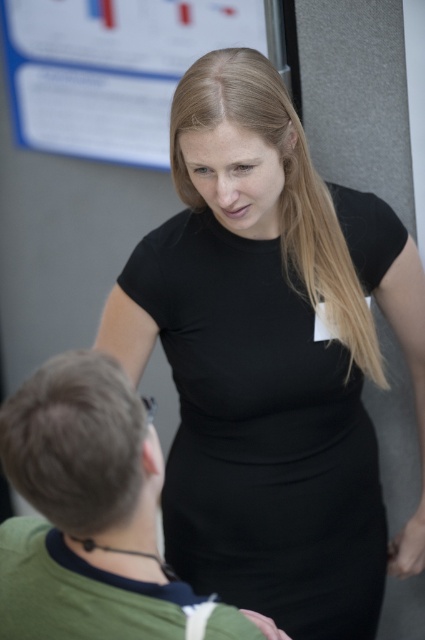
You are an event planner arranging seating for a formal dinner. You need to place a table between the black matte dress at center and the green matte shirt at lower left. Based on their positions, where should the table be placed?

The table should be placed between the black matte dress at center and the green matte shirt at lower left since the black matte dress at center is above the green matte shirt at lower left, so placing the table in between their vertical positions would create a balanced arrangement.

You are organizing a presentation and need to decide which item to place in a narrow display case. The case can only accommodate items that are less than 1 inch thick. You have the green matte shirt at lower left and the blue paper at upper center. Which item would fit better in the case?

The green matte shirt at lower left is thinner than the blue paper at upper center, so it would fit better in the narrow display case.

You are standing in the room and want to place a small plant pot at the point marked as point [255,244]. The plant pot requires a space that is at least 5 feet away from the camera to avoid blocking the view. Is this point suitable for placing the plant pot?

The distance of point [255,244] from the camera is 4.85 feet, which is less than the required 5 feet. Therefore, placing the plant pot here would block the view and is not suitable.